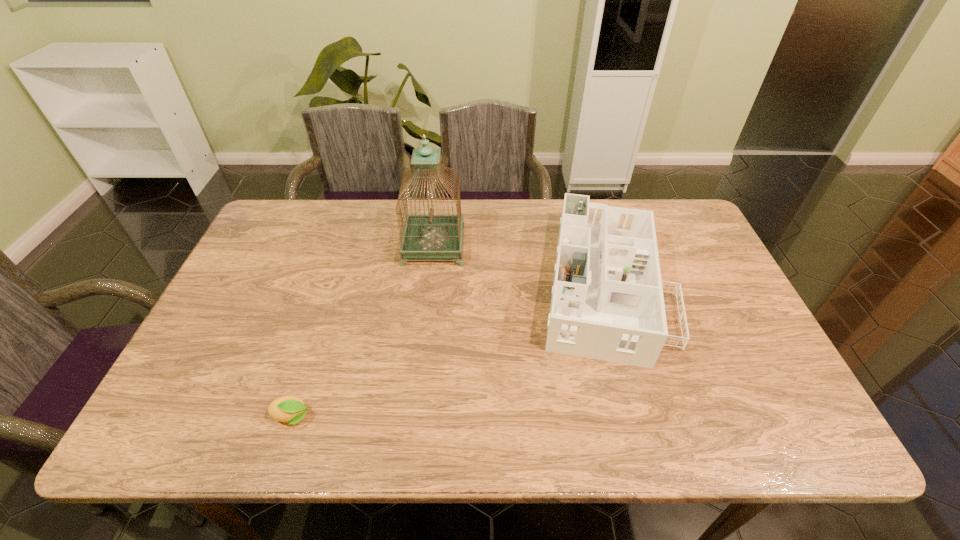
The width and height of the screenshot is (960, 540). Find the location of `free spot between the birdcage and the leftmost object`. free spot between the birdcage and the leftmost object is located at coordinates (363, 332).

At what (x,y) coordinates should I click in order to perform the action: click on free space between the second tallest object and the birdcage. Please return your answer as a coordinate pair (x, y). Looking at the image, I should click on (518, 266).

Identify the location of vacant space in between the nearest object and the rightmost object. (448, 352).

Locate an element on the screen. The height and width of the screenshot is (540, 960). unoccupied position between the rightmost object and the tallest object is located at coordinates click(518, 266).

The image size is (960, 540). Find the location of `free area in between the tallest object and the shortest object`. free area in between the tallest object and the shortest object is located at coordinates (363, 332).

I want to click on free area in between the nearest object and the dollhouse, so click(448, 352).

I want to click on empty space between the leftmost object and the dollhouse, so (x=448, y=352).

Locate an element on the screen. The width and height of the screenshot is (960, 540). free space that is in between the lemon and the birdcage is located at coordinates (363, 332).

You are a GUI agent. You are given a task and a screenshot of the screen. Output one action in this format:
    pyautogui.click(x=<x>, y=<y>)
    Task: Click on the object that stands as the closest to the shortest object
    This screenshot has height=540, width=960.
    Given the screenshot: What is the action you would take?
    pyautogui.click(x=430, y=236)

Identify the location of object that is the closest one to the leftmost object. (430, 236).